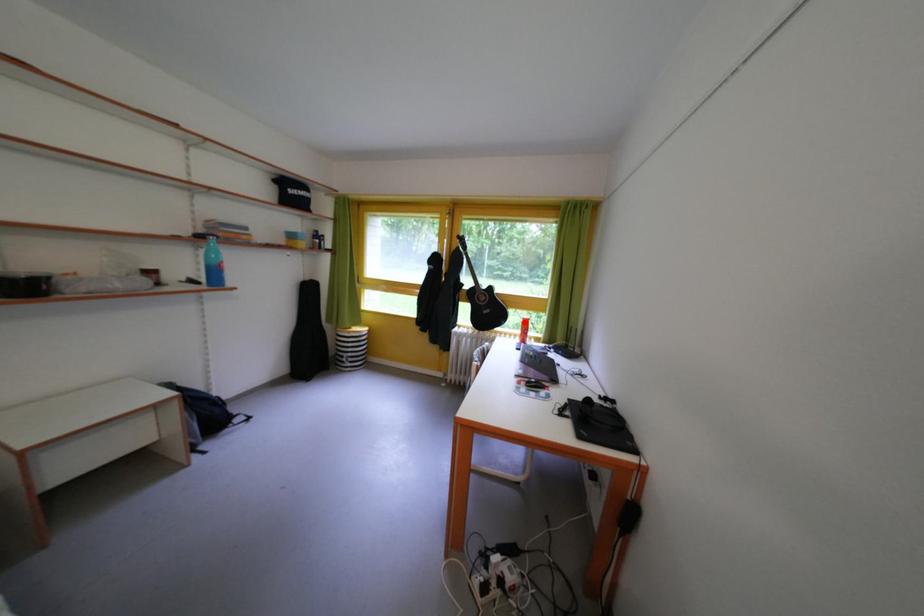
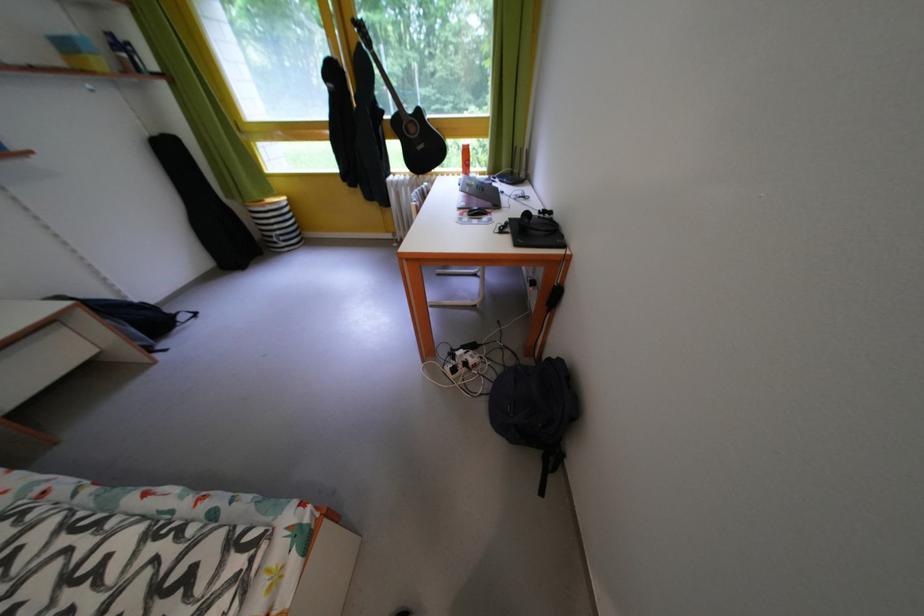
Where in the second image is the point corresponding to the highlighted location from the first image?

(465, 153)